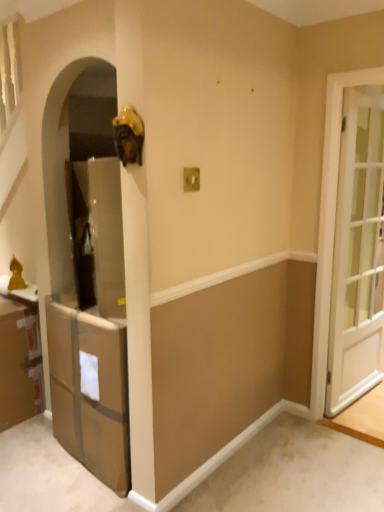
Question: Does brown cardboard cabinet at lower left, acting as the first cabinetry starting from the right, come in front of white glossy door at right?

Choices:
 (A) yes
 (B) no

Answer: (A)

Question: Is brown cardboard cabinet at lower left, acting as the first cabinetry starting from the right, positioned behind white glossy door at right?

Choices:
 (A) no
 (B) yes

Answer: (A)

Question: Is brown cardboard cabinet at lower left, acting as the first cabinetry starting from the right, directly adjacent to white glossy door at right?

Choices:
 (A) yes
 (B) no

Answer: (B)

Question: Does brown cardboard cabinet at lower left, acting as the first cabinetry starting from the right, appear on the right side of white glossy door at right?

Choices:
 (A) yes
 (B) no

Answer: (B)

Question: Considering the relative sizes of brown cardboard cabinet at lower left, acting as the first cabinetry starting from the right, and white glossy door at right in the image provided, is brown cardboard cabinet at lower left, acting as the first cabinetry starting from the right, thinner than white glossy door at right?

Choices:
 (A) yes
 (B) no

Answer: (B)

Question: Can you confirm if brown cardboard cabinet at lower left, which is counted as the second cabinetry, starting from the left, is smaller than white glossy door at right?

Choices:
 (A) no
 (B) yes

Answer: (A)

Question: From the image's perspective, is white glossy door at right under brown cardboard cabinet at lower left, positioned as the first cabinetry in left-to-right order?

Choices:
 (A) no
 (B) yes

Answer: (A)

Question: Can you confirm if white glossy door at right is thinner than brown cardboard cabinet at lower left, positioned as the first cabinetry in left-to-right order?

Choices:
 (A) no
 (B) yes

Answer: (B)

Question: From a real-world perspective, is white glossy door at right beneath brown cardboard cabinet at lower left, the 2th cabinetry from the right?

Choices:
 (A) no
 (B) yes

Answer: (A)

Question: Is the position of white glossy door at right more distant than that of brown cardboard cabinet at lower left, the 2th cabinetry from the right?

Choices:
 (A) yes
 (B) no

Answer: (B)

Question: Is white glossy door at right beside brown cardboard cabinet at lower left, the 2th cabinetry from the right?

Choices:
 (A) no
 (B) yes

Answer: (A)

Question: From a real-world perspective, is white glossy door at right on brown cardboard cabinet at lower left, the 2th cabinetry from the right?

Choices:
 (A) yes
 (B) no

Answer: (A)

Question: Is brown cardboard cabinet at lower left, positioned as the first cabinetry in left-to-right order, placed right next to white glossy door at right?

Choices:
 (A) yes
 (B) no

Answer: (B)